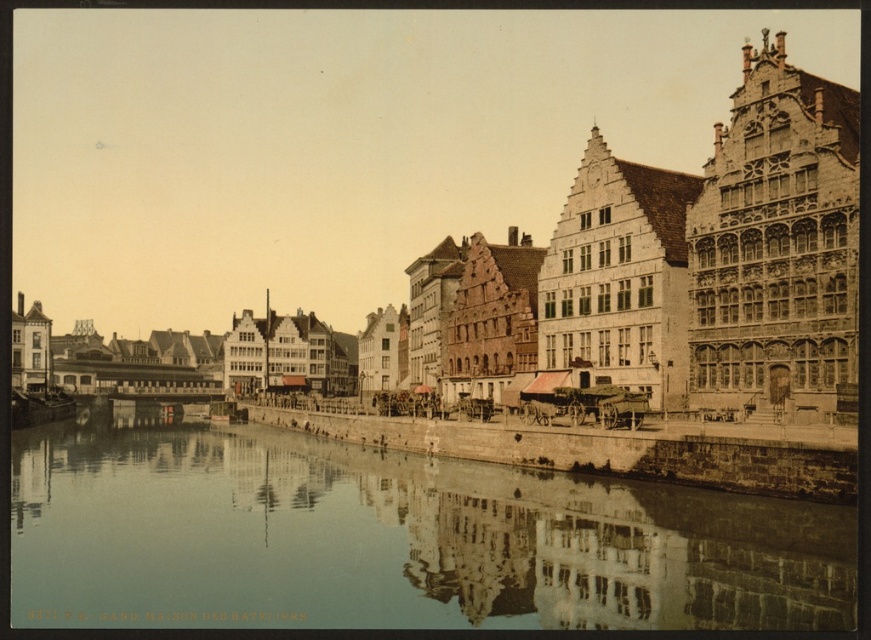
Can you confirm if stone building at center is positioned below smooth concrete river at center?

No, stone building at center is not below smooth concrete river at center.

Who is positioned more to the right, stone building at center or smooth concrete river at center?

Positioned to the right is smooth concrete river at center.

Does point (670, 88) come farther from viewer compared to point (130, 502)?

Yes.

Locate an element on the screen. stone building at center is located at coordinates (458, 195).